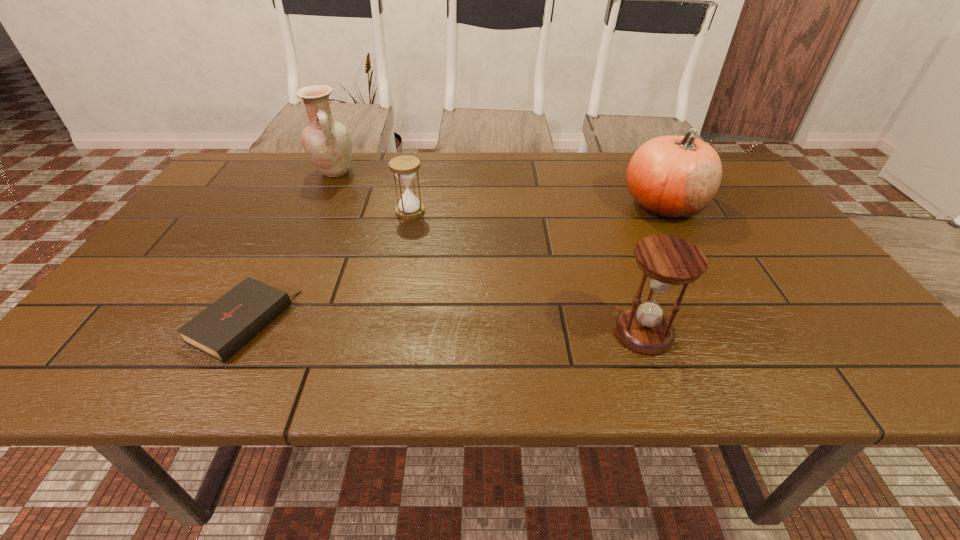
Identify which object is located as the nearest to the nearer hourglass. Please provide its 2D coordinates. Your answer should be formatted as a tuple, i.e. [(x, y)], where the tuple contains the x and y coordinates of a point satisfying the conditions above.

[(673, 177)]

Locate an element on the screen. The height and width of the screenshot is (540, 960). free space in the image that satisfies the following two spatial constraints: 1. on the back side of the shortest object; 2. on the right side of the second shortest object is located at coordinates (301, 212).

Locate an element on the screen. Image resolution: width=960 pixels, height=540 pixels. vacant space that satisfies the following two spatial constraints: 1. on the back side of the pottery; 2. on the left side of the Bible is located at coordinates (323, 172).

Where is `vacant space that satisfies the following two spatial constraints: 1. on the front side of the shorter hourglass; 2. on the right side of the pottery`? vacant space that satisfies the following two spatial constraints: 1. on the front side of the shorter hourglass; 2. on the right side of the pottery is located at coordinates (315, 212).

Locate an element on the screen. The width and height of the screenshot is (960, 540). vacant space that satisfies the following two spatial constraints: 1. on the front side of the shorter hourglass; 2. on the left side of the nearer hourglass is located at coordinates (385, 333).